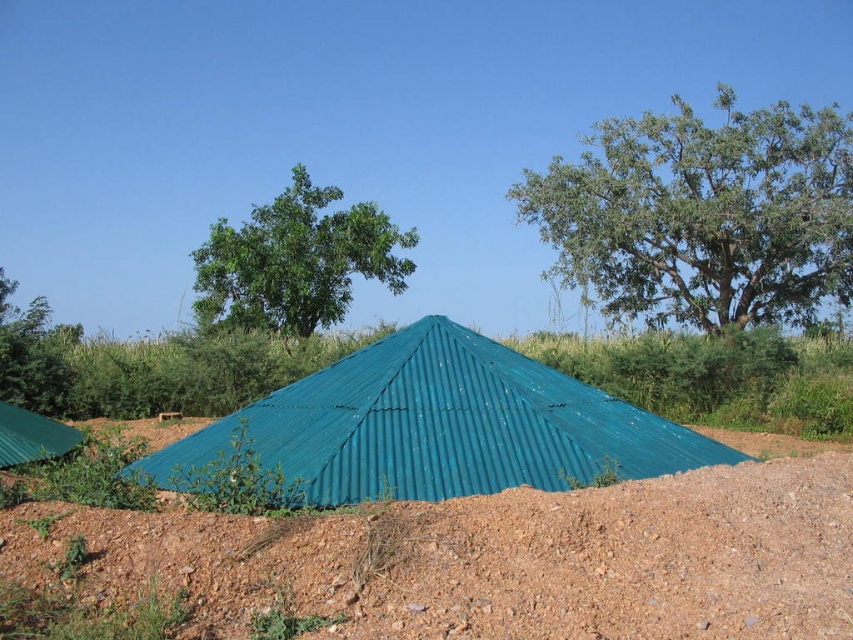
How distant is brown gravelly dirt at center from teal corrugated metal tent at center?

brown gravelly dirt at center and teal corrugated metal tent at center are 3.26 meters apart.

Where is `brown gravelly dirt at center`? The image size is (853, 640). brown gravelly dirt at center is located at coordinates (508, 556).

Can you confirm if green leafy tree at upper left is wider than green leafy tree at left?

No, green leafy tree at upper left is not wider than green leafy tree at left.

Is green leafy tree at upper left shorter than green leafy tree at left?

Incorrect, green leafy tree at upper left's height does not fall short of green leafy tree at left's.

Describe the element at coordinates (294, 260) in the screenshot. I see `green leafy tree at upper left` at that location.

The height and width of the screenshot is (640, 853). I want to click on green leafy tree at upper left, so click(x=294, y=260).

Is teal corrugated metal tent at center positioned before green leafy tree at left?

Yes, it is in front of green leafy tree at left.

Identify the location of teal corrugated metal tent at center. Image resolution: width=853 pixels, height=640 pixels. (433, 428).

Where is `teal corrugated metal tent at center`? This screenshot has width=853, height=640. teal corrugated metal tent at center is located at coordinates (433, 428).